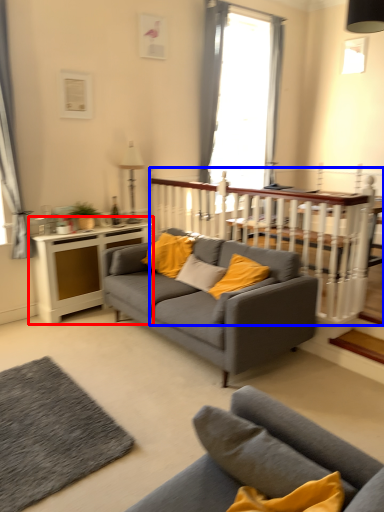
Question: Which point is closer to the camera, table (highlighted by a red box) or balustrade (highlighted by a blue box)?

Choices:
 (A) table
 (B) balustrade

Answer: (B)